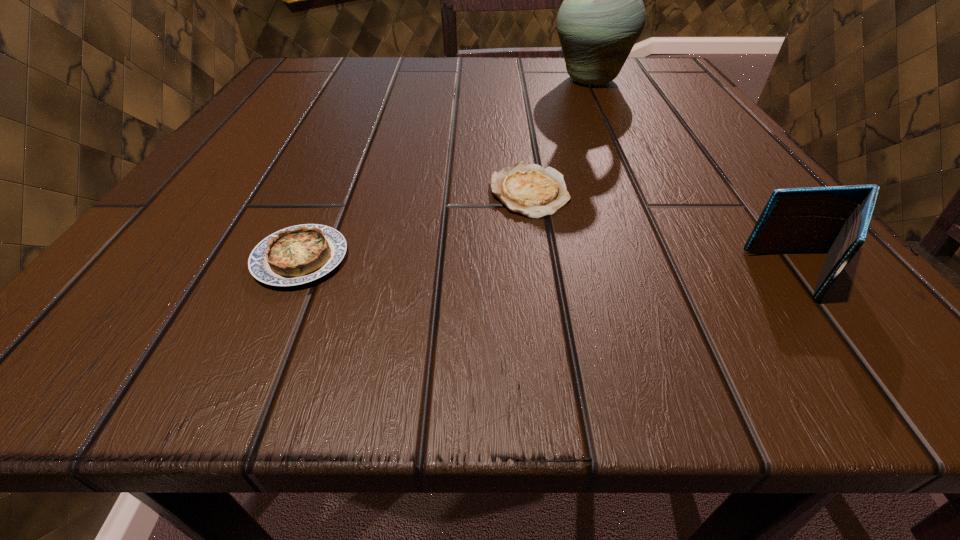
Where is `vacant space in between the taller quiche and the second tallest object`? The image size is (960, 540). vacant space in between the taller quiche and the second tallest object is located at coordinates (553, 267).

Find the location of a particular element. The width and height of the screenshot is (960, 540). free spot between the farthest object and the second object from left to right is located at coordinates (560, 136).

Where is `vacant space that's between the leftmost object and the farthest object`? vacant space that's between the leftmost object and the farthest object is located at coordinates (445, 170).

I want to click on empty space that is in between the wallet and the taller quiche, so click(x=553, y=267).

I want to click on unoccupied position between the tallest object and the leftmost object, so click(x=445, y=170).

At what (x,y) coordinates should I click in order to perform the action: click on free space between the nearer quiche and the farthest object. Please return your answer as a coordinate pair (x, y). The height and width of the screenshot is (540, 960). Looking at the image, I should click on (445, 170).

The image size is (960, 540). In order to click on free space between the second object from left to right and the second tallest object in this screenshot , I will do `click(667, 234)`.

Where is `free area in between the leftmost object and the pitcher`? This screenshot has height=540, width=960. free area in between the leftmost object and the pitcher is located at coordinates click(445, 170).

At what (x,y) coordinates should I click in order to perform the action: click on free space between the wallet and the tallest object. Please return your answer as a coordinate pair (x, y). Looking at the image, I should click on tap(698, 178).

Find the location of `unoccupied position between the left quiche and the second farthest object`. unoccupied position between the left quiche and the second farthest object is located at coordinates (415, 225).